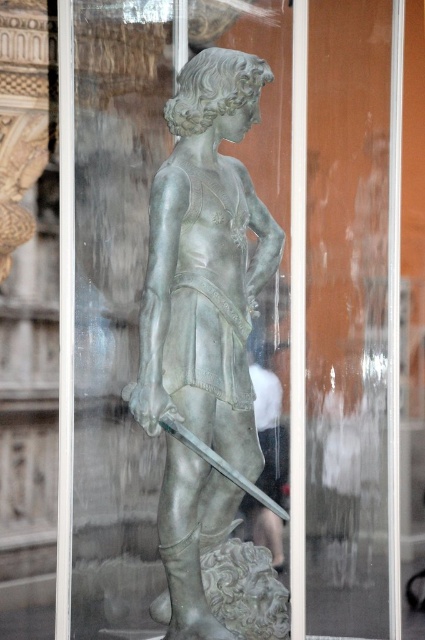
Question: Is shiny bronze statue at center positioned at the back of polished silver sword at center?

Choices:
 (A) yes
 (B) no

Answer: (B)

Question: Which of the following is the closest to the observer?

Choices:
 (A) shiny bronze statue at center
 (B) polished silver sword at center

Answer: (A)

Question: Is shiny bronze statue at center bigger than polished silver sword at center?

Choices:
 (A) no
 (B) yes

Answer: (B)

Question: Can you confirm if shiny bronze statue at center is smaller than polished silver sword at center?

Choices:
 (A) no
 (B) yes

Answer: (A)